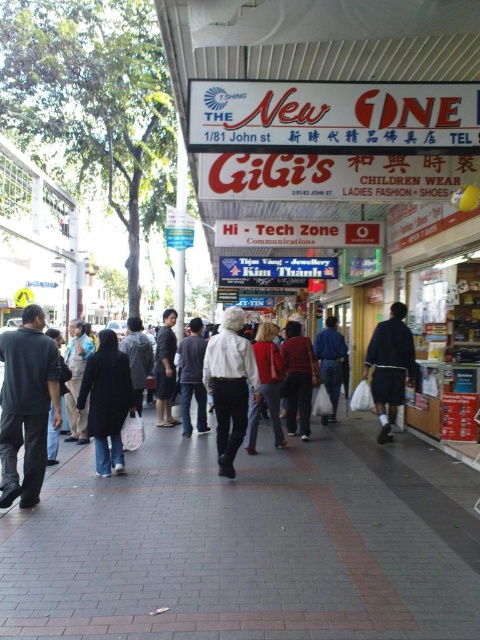
Question: Among these points, which one is nearest to the camera?

Choices:
 (A) (233, 333)
 (B) (36, 496)
 (C) (164, 380)
 (D) (111, 499)

Answer: (B)

Question: Which object is the farthest from the dark gray fabric jacket at center?

Choices:
 (A) dark gray pants at center
 (B) blue denim jeans at center
 (C) dark blue fabric coat at center

Answer: (A)

Question: Which point appears closest to the camera in this image?

Choices:
 (A) (392, 346)
 (B) (349, 440)
 (C) (10, 374)
 (D) (200, 349)

Answer: (C)

Question: Can you confirm if matte red sweater at center is positioned to the left of velvet red coat at center?

Choices:
 (A) no
 (B) yes

Answer: (A)

Question: Is dark gray clothing at center thinner than white matte shirt at center?

Choices:
 (A) yes
 (B) no

Answer: (B)

Question: Is matte red sweater at center behind blue denim jeans at center?

Choices:
 (A) no
 (B) yes

Answer: (A)